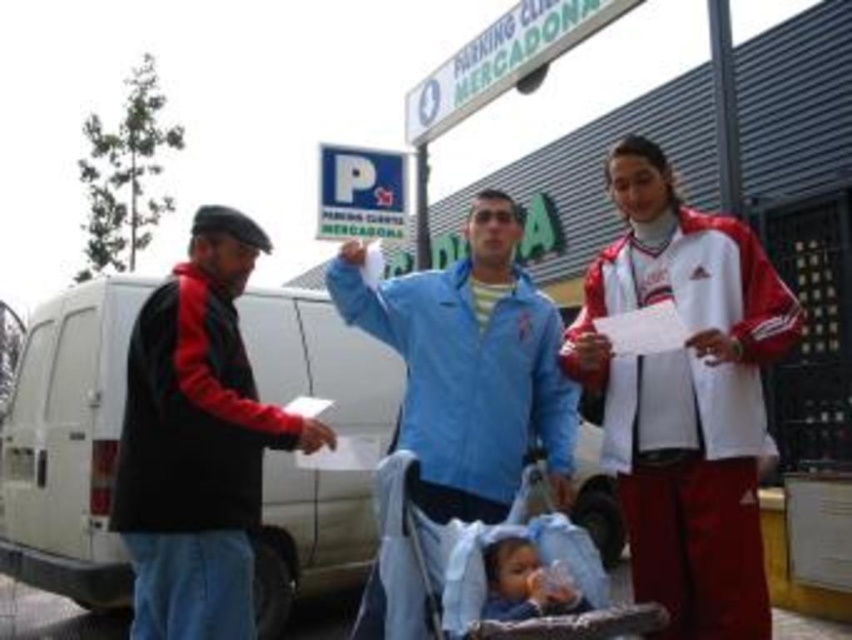
Question: Considering the real-world distances, which object is farthest from the white matte van at left?

Choices:
 (A) blue fabric baby carriage at center
 (B) blue fabric jacket at center
 (C) soft blue fabric at center
 (D) black fleece jacket at left

Answer: (C)

Question: Can you confirm if blue fabric baby carriage at center is positioned to the right of soft blue fabric at center?

Choices:
 (A) yes
 (B) no

Answer: (B)

Question: Does white matte van at left have a lesser width compared to soft blue fabric at center?

Choices:
 (A) yes
 (B) no

Answer: (B)

Question: Based on their relative distances, which object is nearer to the white matte van at left?

Choices:
 (A) soft blue fabric at center
 (B) black fleece jacket at left
 (C) blue fabric baby carriage at center

Answer: (B)

Question: Is white matte van at left in front of black fleece jacket at left?

Choices:
 (A) yes
 (B) no

Answer: (B)

Question: Estimate the real-world distances between objects in this image. Which object is farther from the black fleece jacket at left?

Choices:
 (A) soft blue fabric at center
 (B) white matte van at left
 (C) blue fabric jacket at center
 (D) blue fabric baby carriage at center

Answer: (B)